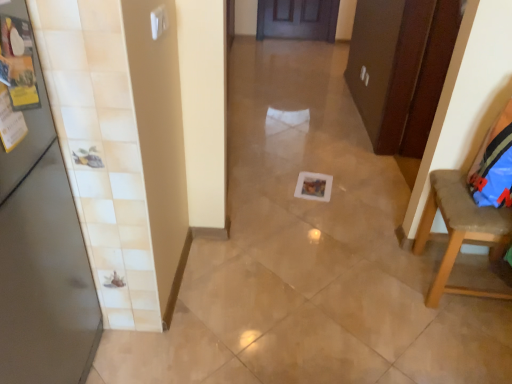
You are a GUI agent. You are given a task and a screenshot of the screen. Output one action in this format:
    pyautogui.click(x=<x>, y=<y>)
    Task: Click on the free location in front of brown fabric chair at right
    
    Given the screenshot: What is the action you would take?
    pyautogui.click(x=462, y=344)